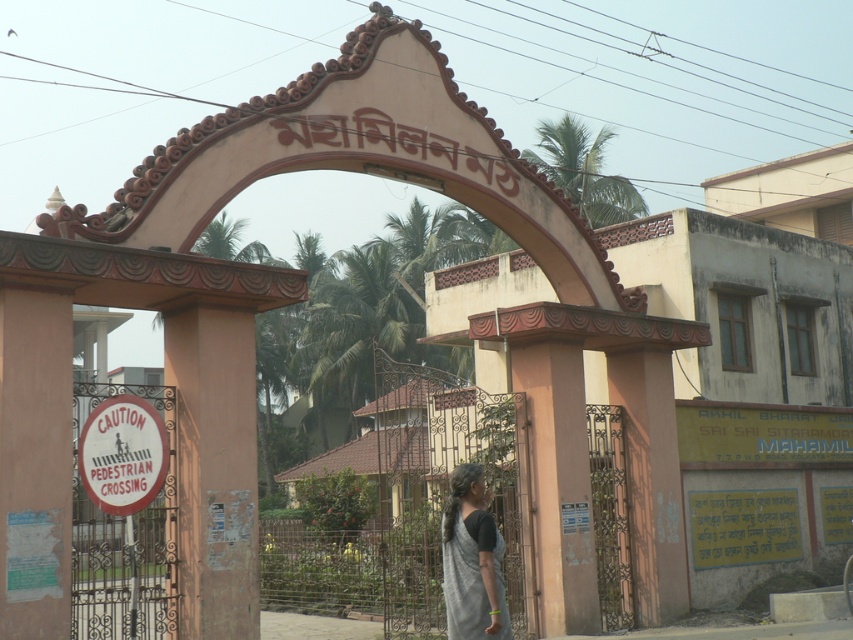
Question: Among these points, which one is farthest from the camera?

Choices:
 (A) (141, 444)
 (B) (451, 472)

Answer: (A)

Question: Can you confirm if black cotton saree at center is bigger than white paper sign at lower left?

Choices:
 (A) yes
 (B) no

Answer: (A)

Question: Is the position of beige stone archway at center more distant than that of black cotton saree at center?

Choices:
 (A) no
 (B) yes

Answer: (B)

Question: Which point appears closest to the camera in this image?

Choices:
 (A) (352, 154)
 (B) (445, 550)

Answer: (B)

Question: Does white plastic sign at left appear on the right side of black cotton saree at center?

Choices:
 (A) yes
 (B) no

Answer: (B)

Question: Which object is positioned closest to the black cotton saree at center?

Choices:
 (A) white plastic sign at left
 (B) beige stone archway at center
 (C) white paper sign at lower left

Answer: (C)